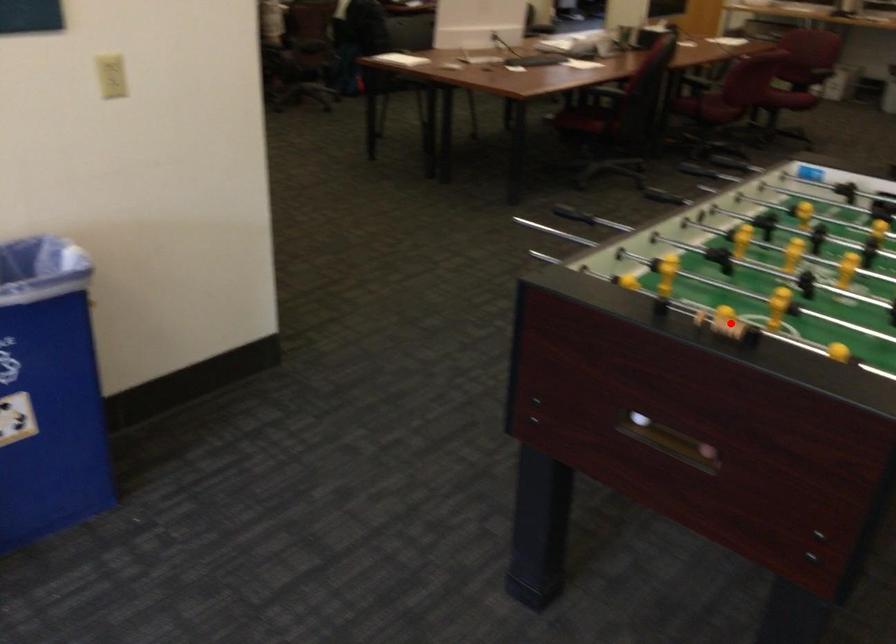
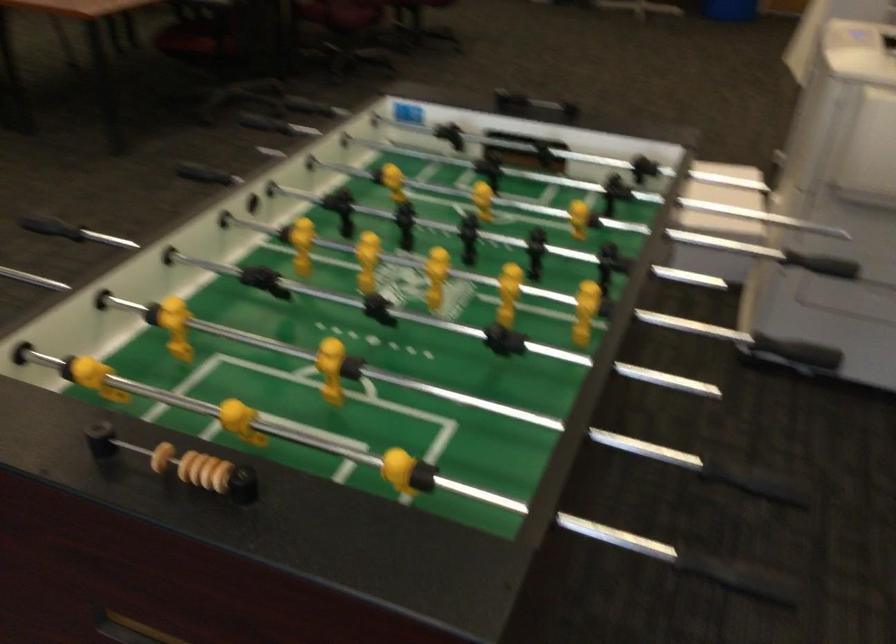
Question: I am providing you with two images of the same scene from different viewpoints. A red point is shown in image1. For the corresponding object point in image2, is it positioned nearer or farther from the camera?

Choices:
 (A) Nearer
 (B) Farther

Answer: (A)